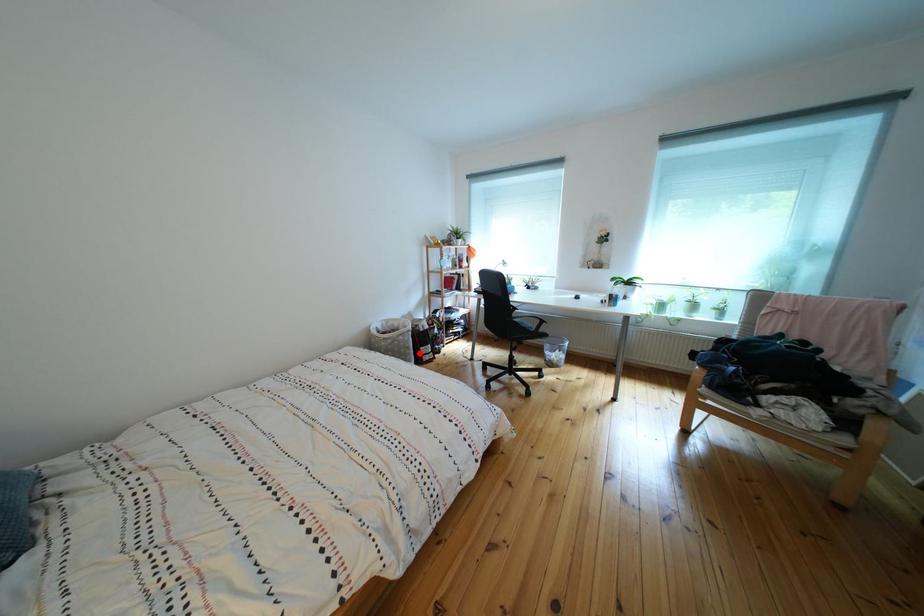
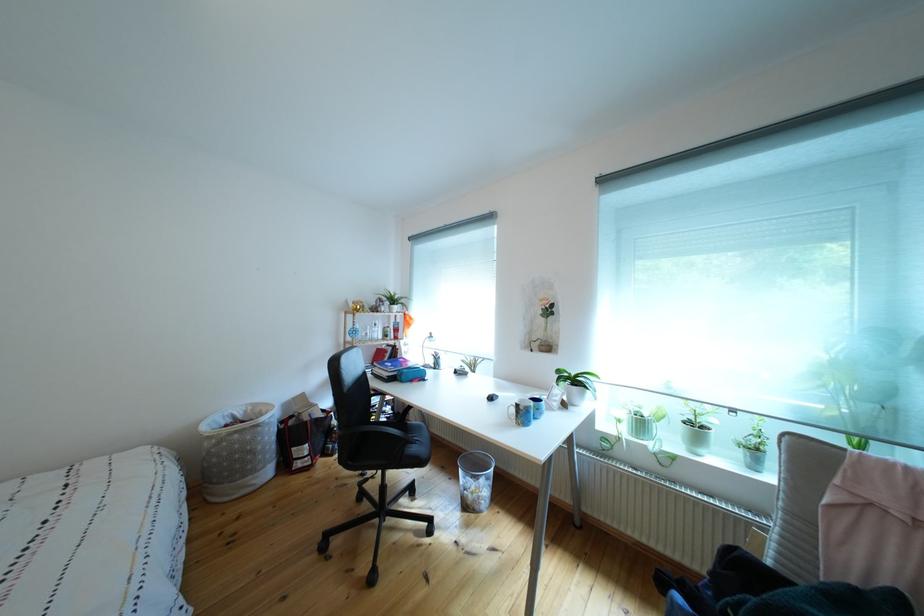
Question: I am providing you with two images of the same scene from different viewpoints. Image1 has a red point marked. In image2, the corresponding 3D location appears at what relative position? Reply with the corresponding letter.

Choices:
 (A) Closer
 (B) Farther

Answer: (B)